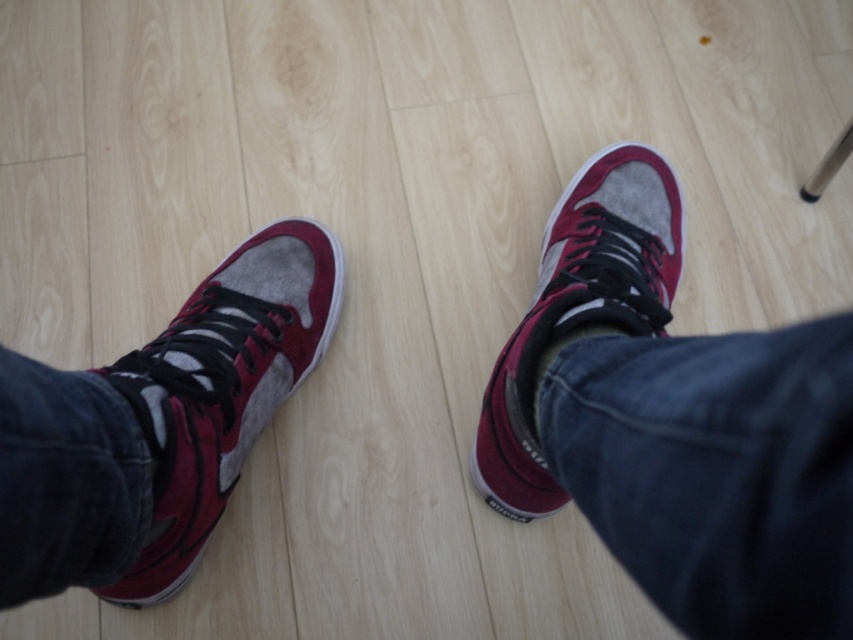
Question: Does suede/maroon sneaker at left come behind matte suede sneaker at center?

Choices:
 (A) no
 (B) yes

Answer: (A)

Question: Which object is the farthest from the matte suede sneaker at center?

Choices:
 (A) matte suede sneaker at right
 (B) suede/maroon sneaker at left

Answer: (B)

Question: Can you confirm if matte suede sneaker at right is positioned to the right of suede/maroon sneaker at left?

Choices:
 (A) yes
 (B) no

Answer: (A)

Question: Which point appears farthest from the camera in this image?

Choices:
 (A) (526, 445)
 (B) (219, 378)
 (C) (711, 520)

Answer: (B)

Question: Which point is closer to the camera taking this photo?

Choices:
 (A) (171, 376)
 (B) (596, 490)
 (C) (480, 460)

Answer: (B)

Question: Is matte suede sneaker at right behind suede/maroon sneaker at left?

Choices:
 (A) no
 (B) yes

Answer: (A)